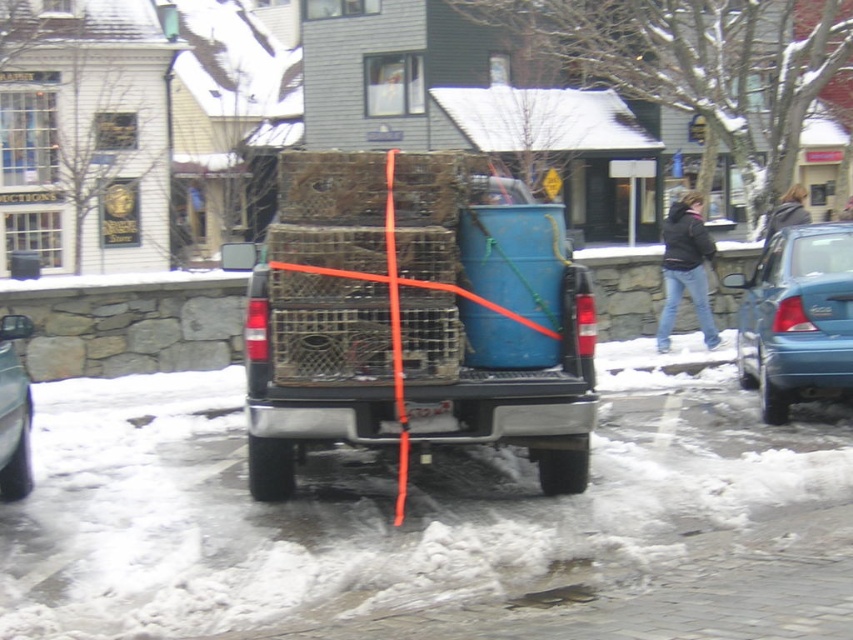
Does snowy asphalt at lower center have a lesser height compared to teal matte car at right?

Yes.

Does snowy asphalt at lower center have a larger size compared to teal matte car at right?

Incorrect, snowy asphalt at lower center is not larger than teal matte car at right.

Locate an element on the screen. snowy asphalt at lower center is located at coordinates (368, 508).

Measure the distance between point (252, 356) and camera.

Point (252, 356) is 5.54 meters away from camera.

Who is lower down, wooden crates at center or metallic silver car at left?

metallic silver car at left is lower down.

Find the location of a particular element. The width and height of the screenshot is (853, 640). wooden crates at center is located at coordinates (415, 320).

Where is `wooden crates at center`? This screenshot has width=853, height=640. wooden crates at center is located at coordinates (415, 320).

Consider the image. Who is more forward, (822, 288) or (16, 356)?

Positioned in front is point (822, 288).

Is teal matte car at right wider than metallic silver car at left?

Yes, teal matte car at right is wider than metallic silver car at left.

Between point (804, 316) and point (15, 332), which one is positioned behind?

The point (804, 316) is behind.

Find the location of `teal matte car at right`. teal matte car at right is located at coordinates (796, 317).